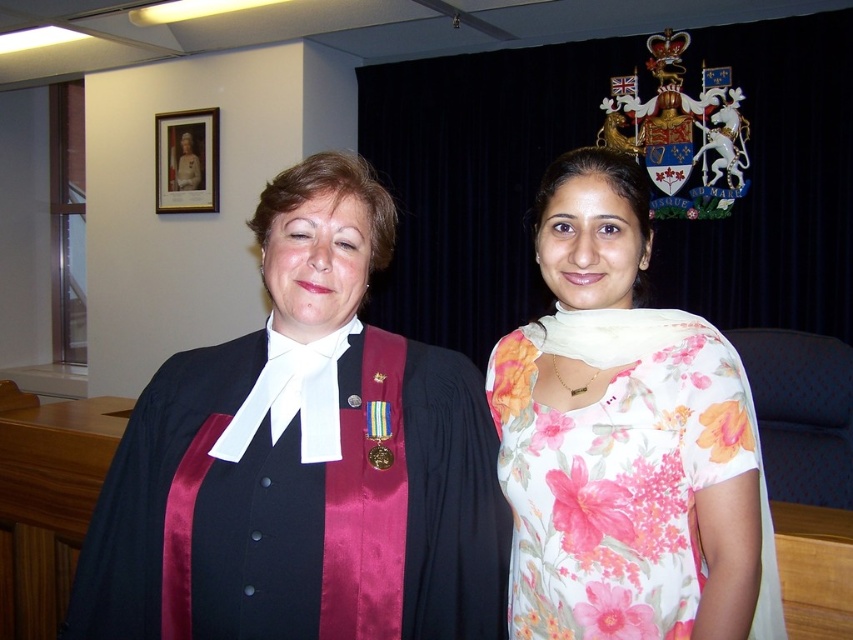
Question: Estimate the real-world distances between objects in this image. Which object is closer to the floral cotton dress at center?

Choices:
 (A) floral fabric scarf at center
 (B) matte black robe at center
 (C) satin black robe at center

Answer: (A)

Question: Does satin black robe at center appear on the right side of floral fabric scarf at center?

Choices:
 (A) no
 (B) yes

Answer: (A)

Question: Which object is farther from the camera taking this photo?

Choices:
 (A) gold-framed portrait at upper left
 (B) floral cotton dress at center
 (C) satin black robe at center

Answer: (A)

Question: Which object appears closest to the camera in this image?

Choices:
 (A) satin black robe at center
 (B) gold-framed portrait at upper left

Answer: (A)

Question: Does satin black robe at center have a greater width compared to floral fabric scarf at center?

Choices:
 (A) no
 (B) yes

Answer: (B)

Question: Can you confirm if satin black robe at center is bigger than floral cotton dress at center?

Choices:
 (A) no
 (B) yes

Answer: (A)